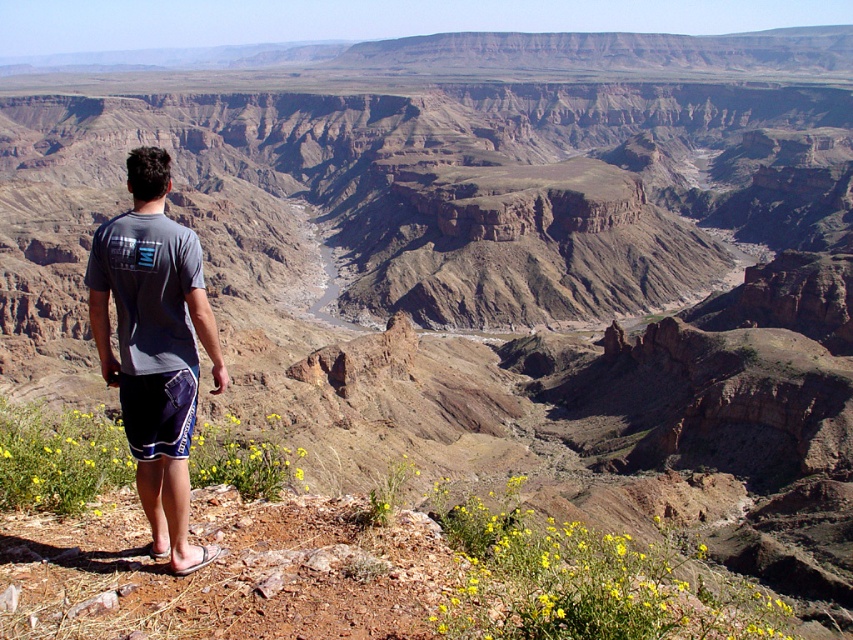
Does yellow matte wildflower at lower left appear under gray fabric t-shirt at center?

Correct, yellow matte wildflower at lower left is located below gray fabric t-shirt at center.

Is yellow matte wildflower at lower left above gray fabric t-shirt at center?

No, yellow matte wildflower at lower left is not above gray fabric t-shirt at center.

Does point (531, 566) come in front of point (120, 292)?

No, it is behind (120, 292).

The image size is (853, 640). Find the location of `yellow matte wildflower at lower left`. yellow matte wildflower at lower left is located at coordinates (335, 563).